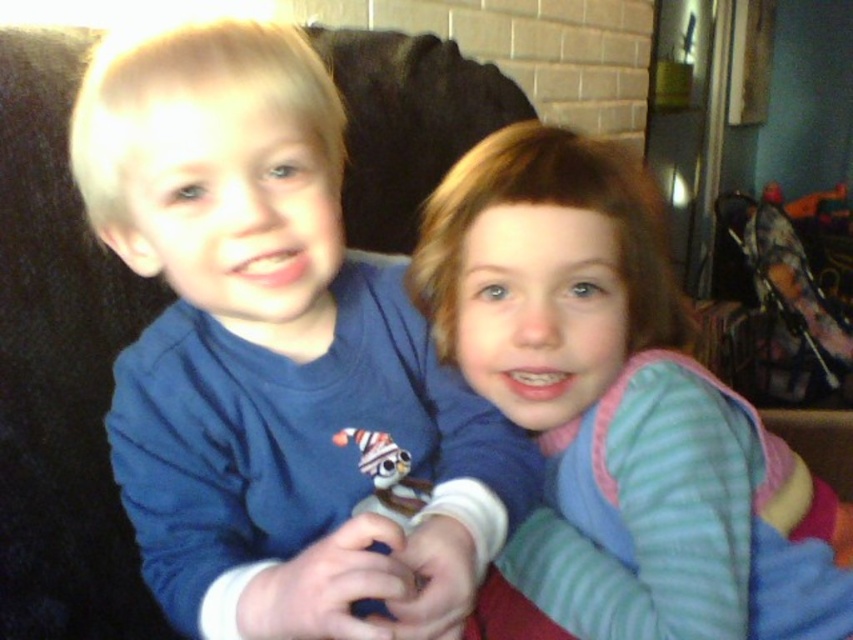
Question: Among these objects, which one is nearest to the camera?

Choices:
 (A) striped fleece sweater at center
 (B) blue cotton shirt at left

Answer: (B)

Question: Does blue cotton shirt at left appear over striped fleece sweater at center?

Choices:
 (A) yes
 (B) no

Answer: (A)

Question: Which of the following is the farthest from the observer?

Choices:
 (A) blue cotton shirt at left
 (B) striped fleece sweater at center

Answer: (B)

Question: Where is blue cotton shirt at left located in relation to striped fleece sweater at center in the image?

Choices:
 (A) below
 (B) above

Answer: (B)

Question: Is blue cotton shirt at left to the right of striped fleece sweater at center from the viewer's perspective?

Choices:
 (A) no
 (B) yes

Answer: (A)